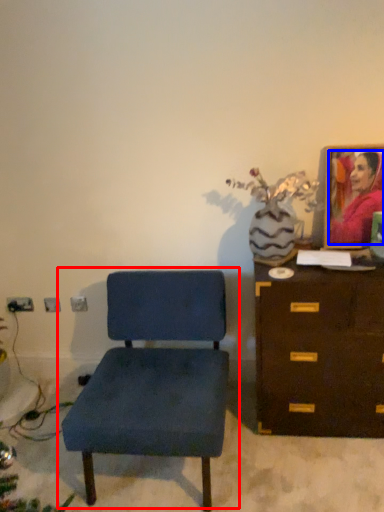
Question: Which of the following is the farthest to the observer, chair (highlighted by a red box) or person (highlighted by a blue box)?

Choices:
 (A) chair
 (B) person

Answer: (B)